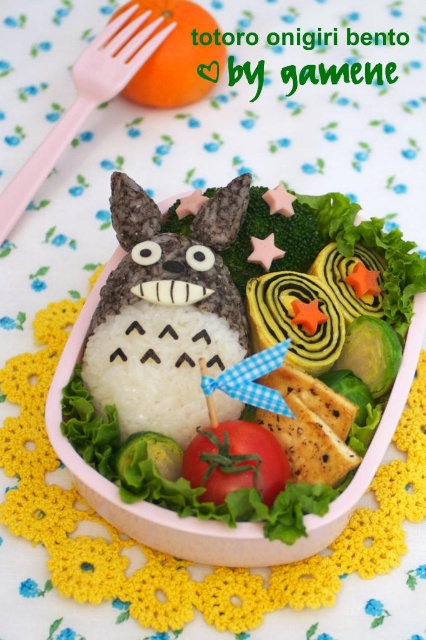
Who is positioned more to the left, orange matte at upper left or red matte tomato at center?

orange matte at upper left

Find the location of a particular element. The height and width of the screenshot is (640, 426). orange matte at upper left is located at coordinates (178, 56).

This screenshot has height=640, width=426. I want to click on orange matte at upper left, so click(x=178, y=56).

Between point (141, 506) and point (51, 157), which one is positioned behind?

Point (51, 157)

Is white rice at center smaller than pink plastic fork at upper left?

Incorrect, white rice at center is not smaller in size than pink plastic fork at upper left.

Identify the location of white rice at center. Image resolution: width=426 pixels, height=640 pixels. (212, 520).

Is white matte rice at center bigger than pink plastic fork at upper left?

Incorrect, white matte rice at center is not larger than pink plastic fork at upper left.

This screenshot has height=640, width=426. In order to click on white matte rice at center in this screenshot , I will do `click(158, 365)`.

Where is `white matte rice at center`? The height and width of the screenshot is (640, 426). white matte rice at center is located at coordinates (158, 365).